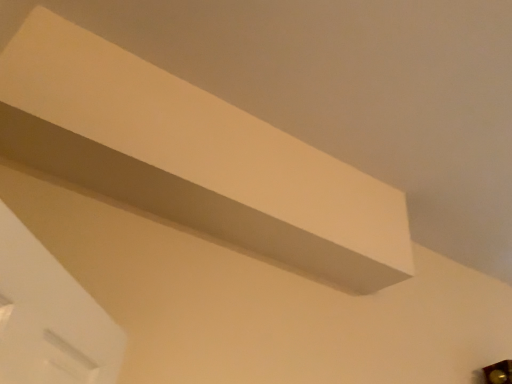
This screenshot has height=384, width=512. What do you see at coordinates (193, 158) in the screenshot? I see `white matte exhaust hood at upper center` at bounding box center [193, 158].

Identify the location of white matte exhaust hood at upper center. (193, 158).

The width and height of the screenshot is (512, 384). I want to click on white matte exhaust hood at upper center, so click(x=193, y=158).